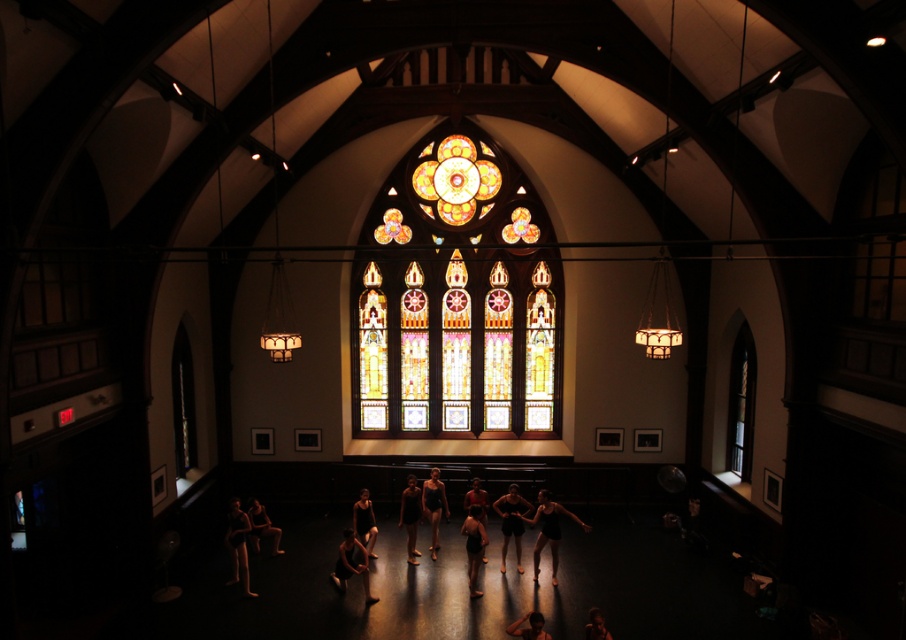
You are a dancer wearing a black matte leotard at center and you want to stretch your arms out fully without touching any objects. Can you do this in the space between the stained glass at center and the walls?

The stained glass at center is wider than the black matte leotard at center. Since the stained glass at center is wider, there is sufficient space for the dancer to stretch their arms out fully without touching any objects.

You are a dancer wearing the black matte leotard at center in the dance studio. You want to touch the stained glass at center above you. Can you reach it with your hand?

The stained glass at center is much taller than the black matte leotard at center, so you cannot reach it with your hand.